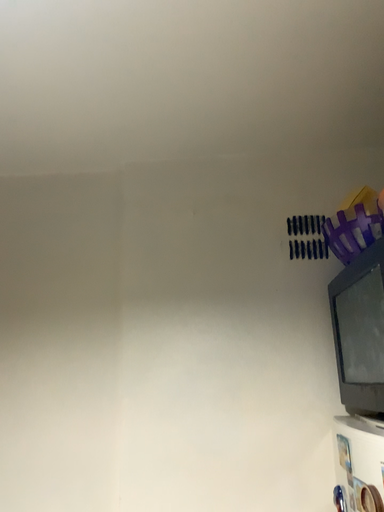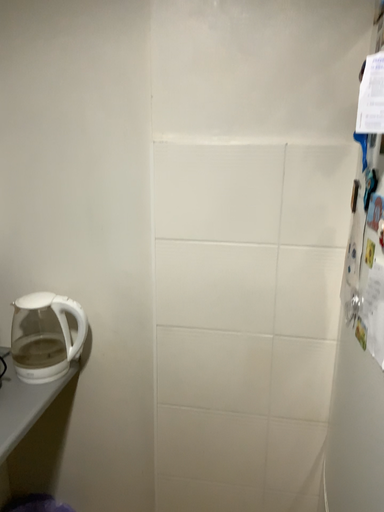
Question: How did the camera likely rotate when shooting the video?

Choices:
 (A) rotated downward
 (B) rotated upward

Answer: (A)